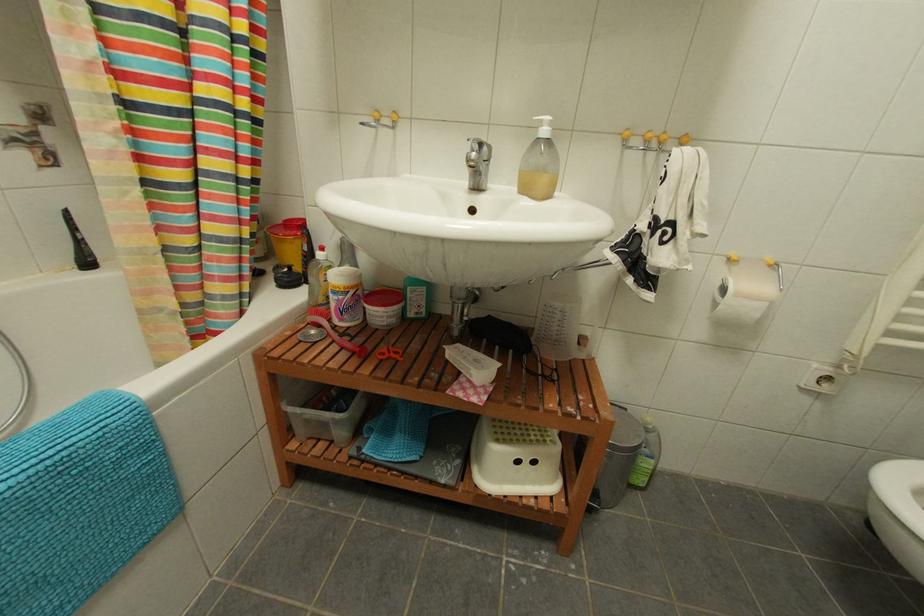
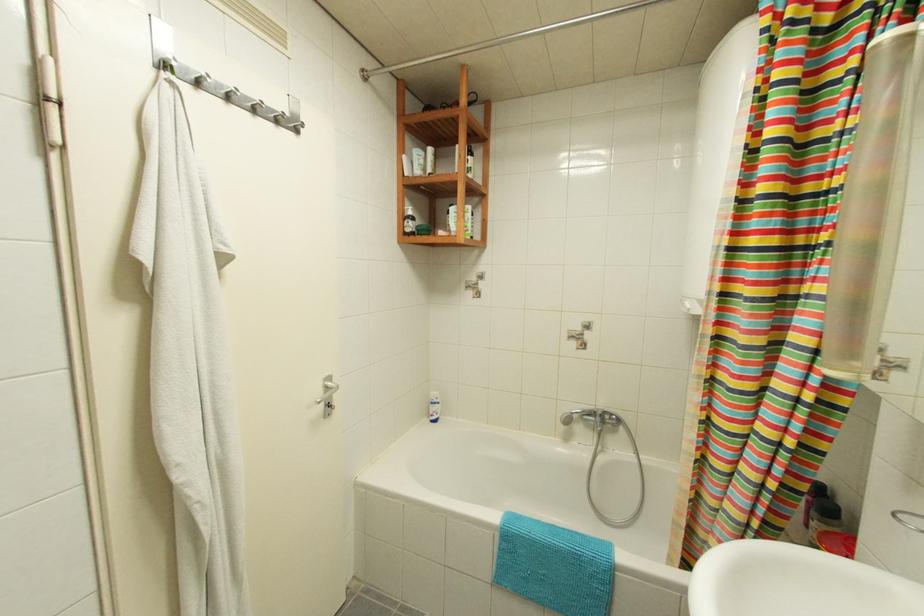
Question: The images are taken continuously from a first-person perspective. In which direction is your viewpoint rotating?

Choices:
 (A) Left
 (B) Right
 (C) Up
 (D) Down

Answer: (A)